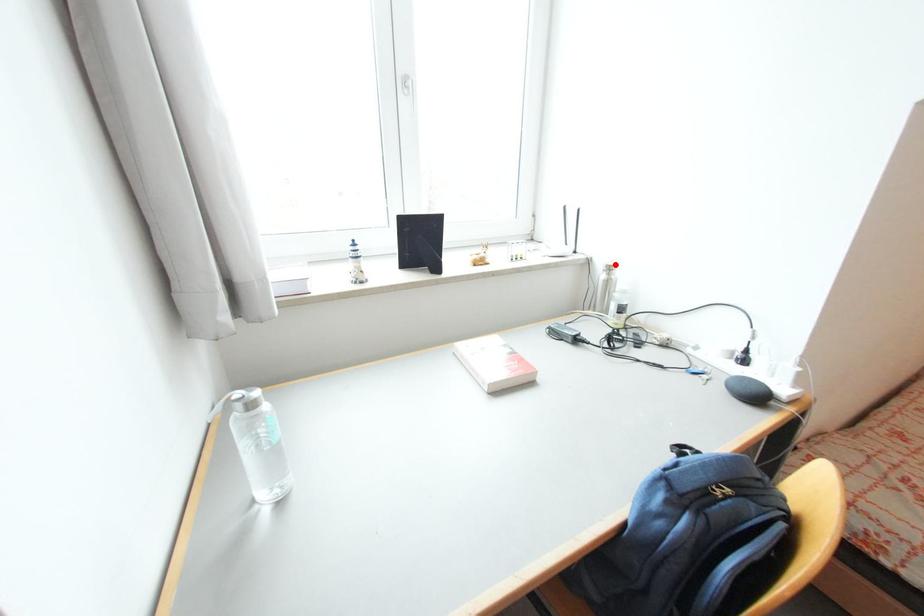
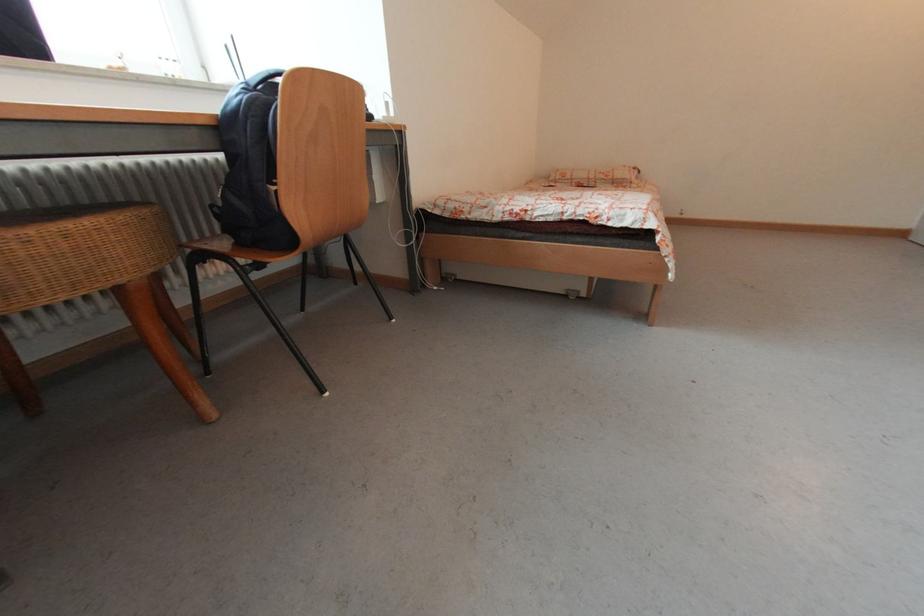
Question: I am providing you with two images of the same scene from different viewpoints. A red point is marked on the first image. Is the red point's position out of view in image 2?

Choices:
 (A) Yes
 (B) No

Answer: (A)